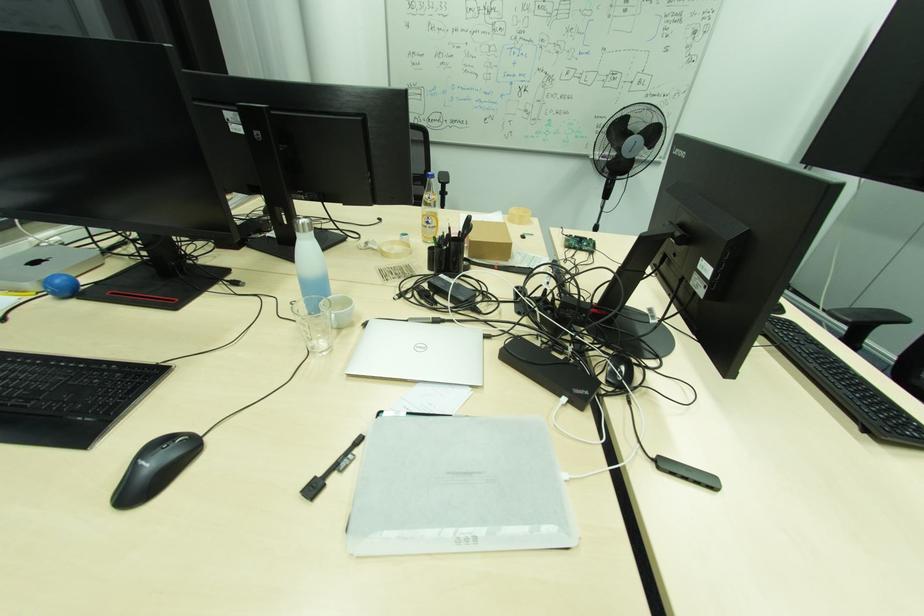
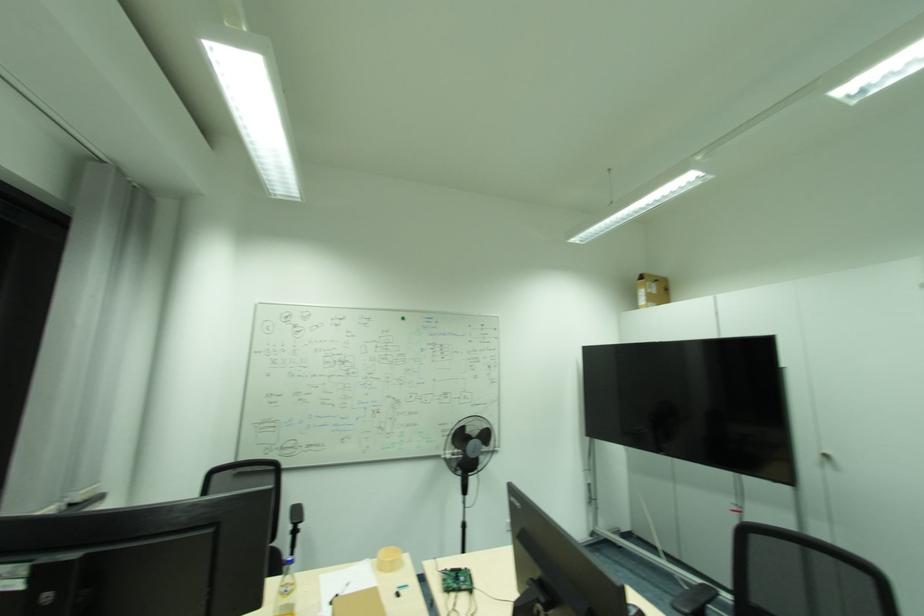
In the second image, find the point that corresponds to point (517, 209) in the first image.

(386, 553)